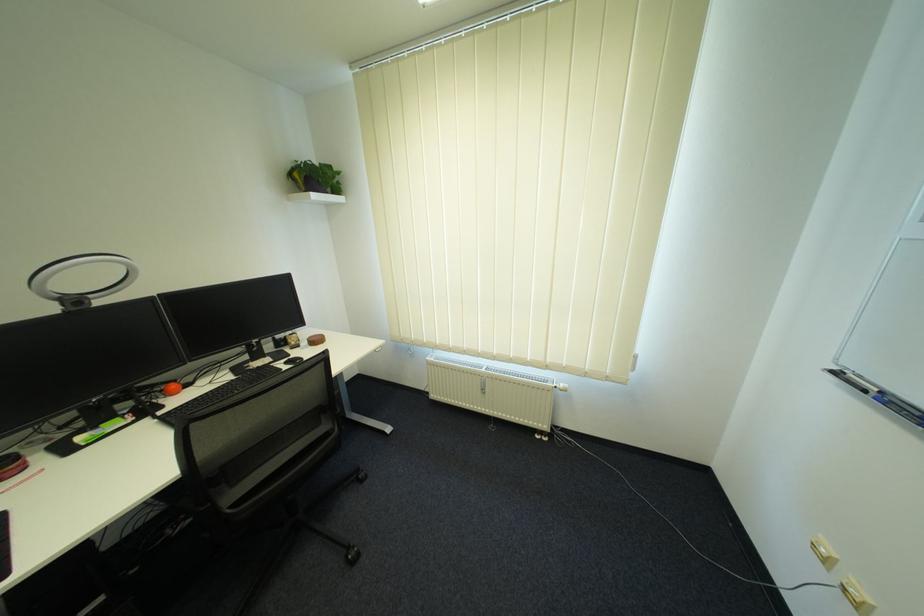
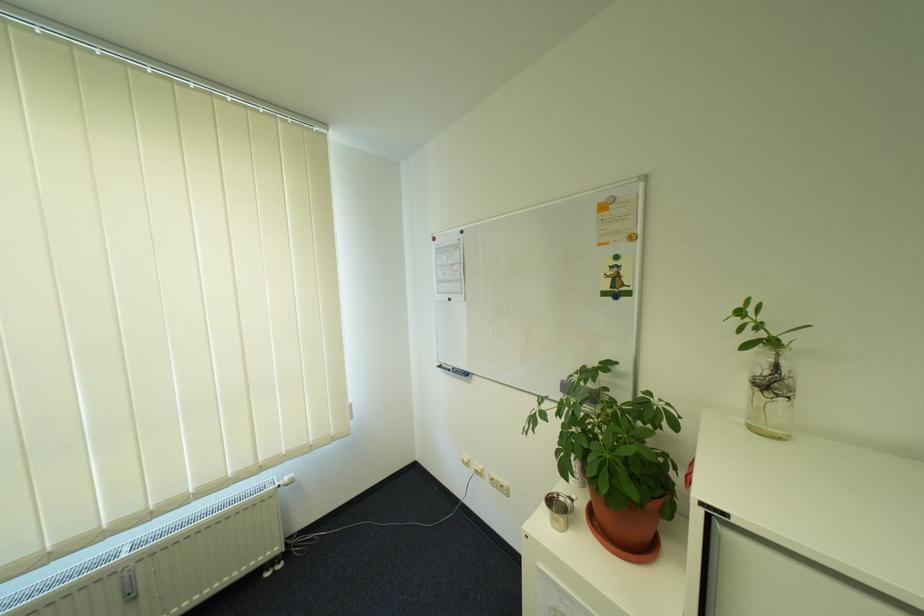
In the second image, find the point that corresponds to the point at 566,387 in the first image.

(290, 484)